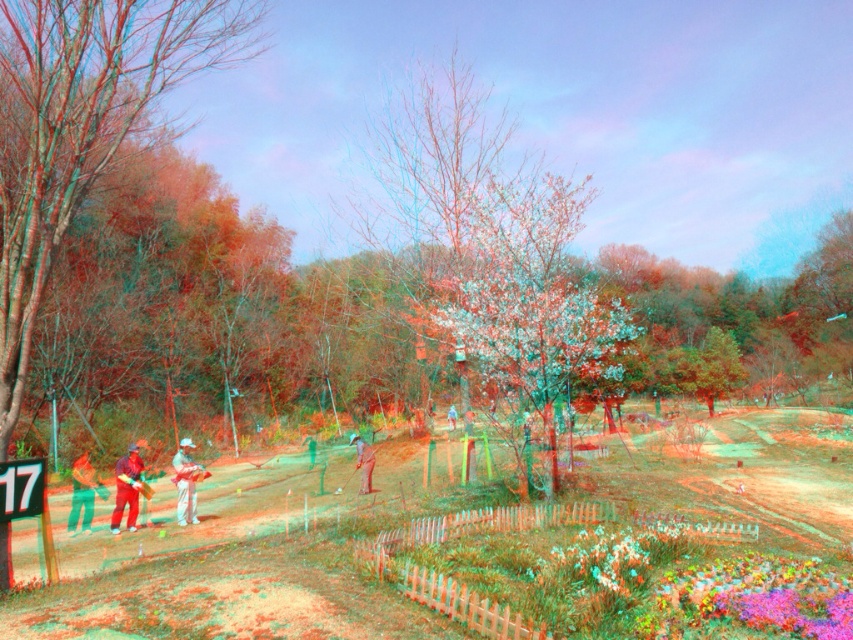
Question: Does smooth green turf at center have a larger size compared to smooth bark tree at left?

Choices:
 (A) yes
 (B) no

Answer: (A)

Question: Is vibrant floral carpet at lower right positioned in front of matte gray shirt at center?

Choices:
 (A) yes
 (B) no

Answer: (A)

Question: Considering the real-world distances, which object is closest to the smooth green turf at center?

Choices:
 (A) light brown fabric pants at center
 (B) vibrant floral carpet at lower right

Answer: (B)

Question: Among these objects, which one is nearest to the camera?

Choices:
 (A) smooth bark tree at left
 (B) green fabric shirt at left
 (C) smooth green turf at center
 (D) vibrant floral carpet at lower right

Answer: (C)

Question: Which object is closer to the camera taking this photo?

Choices:
 (A) vibrant floral carpet at lower right
 (B) smooth green turf at center
 (C) red fabric person at lower left
 (D) smooth bark tree at left

Answer: (B)

Question: Does vibrant floral carpet at lower right come behind light brown fabric pants at center?

Choices:
 (A) no
 (B) yes

Answer: (A)